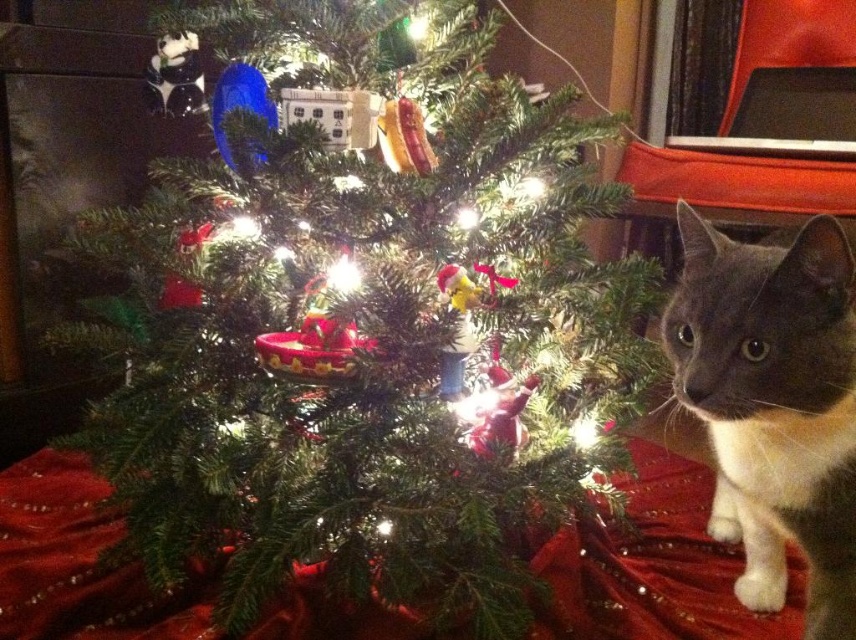
Question: Is green matte christmas tree at center above gray fur cat at right?

Choices:
 (A) no
 (B) yes

Answer: (B)

Question: Observing the image, what is the correct spatial positioning of green matte christmas tree at center in reference to gray fur cat at right?

Choices:
 (A) above
 (B) below

Answer: (A)

Question: Among these points, which one is nearest to the camera?

Choices:
 (A) (696, 376)
 (B) (415, 291)

Answer: (A)

Question: Which of the following is the farthest from the observer?

Choices:
 (A) (210, 317)
 (B) (678, 365)

Answer: (A)

Question: Is green matte christmas tree at center to the left of gray fur cat at right from the viewer's perspective?

Choices:
 (A) yes
 (B) no

Answer: (A)